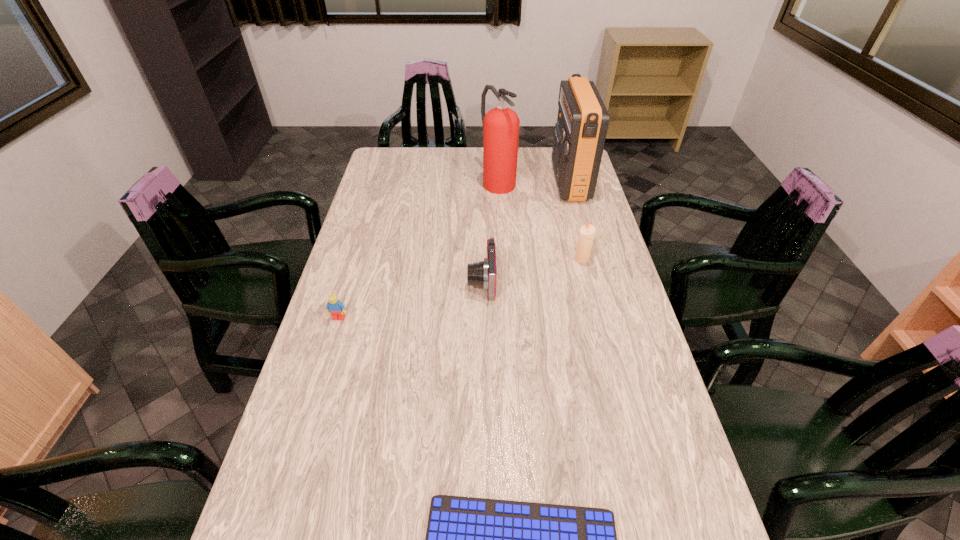
Image resolution: width=960 pixels, height=540 pixels. What are the coordinates of `object located in the far right corner section of the desktop` in the screenshot? It's located at (580, 132).

What are the coordinates of `vacant space at the left edge of the desktop` in the screenshot? It's located at (404, 204).

Locate an element on the screen. The width and height of the screenshot is (960, 540). free point at the right edge is located at coordinates (618, 421).

Locate an element on the screen. The image size is (960, 540). vacant position at the far left corner of the desktop is located at coordinates (381, 151).

The image size is (960, 540). I want to click on vacant area that lies between the Lego and the radio receiver, so click(x=454, y=250).

At what (x,y) coordinates should I click in order to perform the action: click on free space that is in between the candle and the Lego. Please return your answer as a coordinate pair (x, y). This screenshot has height=540, width=960. Looking at the image, I should click on (461, 289).

Image resolution: width=960 pixels, height=540 pixels. Find the location of `vacant space that's between the radio receiver and the leftmost object`. vacant space that's between the radio receiver and the leftmost object is located at coordinates (454, 250).

This screenshot has width=960, height=540. Find the location of `vacant area that lies between the radio receiver and the candle`. vacant area that lies between the radio receiver and the candle is located at coordinates (576, 220).

This screenshot has height=540, width=960. What are the coordinates of `vacant space that is in between the second shortest object and the camera` in the screenshot? It's located at (410, 300).

Identify the location of vacant area between the radio receiver and the fire extinguisher. click(x=534, y=181).